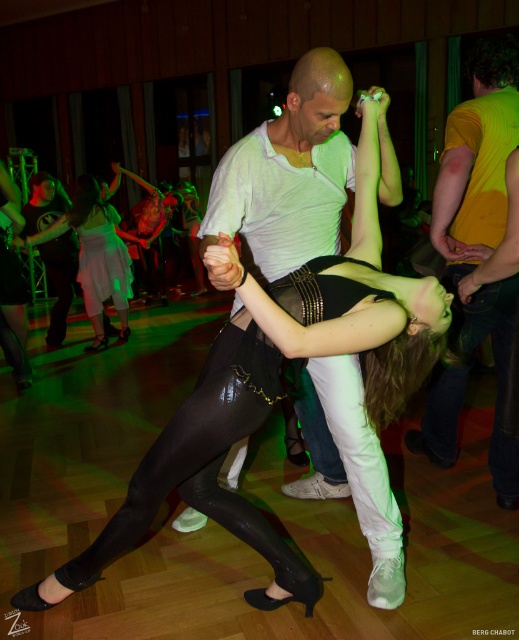
Question: Which point appears farthest from the camera in this image?

Choices:
 (A) (507, 83)
 (B) (442, 300)
 (C) (291, 179)
 (D) (90, 193)

Answer: (D)

Question: Considering the real-world distances, which object is farthest from the matte white shirt at center?

Choices:
 (A) matte black tights at center
 (B) yellow matte shirt at upper right

Answer: (B)

Question: Where is matte white shirt at center located in relation to black leather skirt at center in the image?

Choices:
 (A) above
 (B) below

Answer: (B)

Question: Is matte black tights at center bigger than black leather skirt at center?

Choices:
 (A) no
 (B) yes

Answer: (B)

Question: Among these points, which one is farthest from the camera?

Choices:
 (A) (213, 282)
 (B) (512, 285)
 (C) (214, 472)

Answer: (B)

Question: Is matte black tights at center smaller than matte white shirt at center?

Choices:
 (A) yes
 (B) no

Answer: (B)